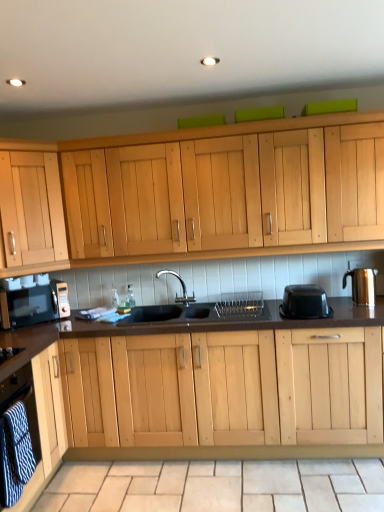
Question: Is black matte sink at center taller or shorter than black plastic container at right?

Choices:
 (A) short
 (B) tall

Answer: (B)

Question: Is point (223, 294) closer or farther from the camera than point (311, 306)?

Choices:
 (A) closer
 (B) farther

Answer: (B)

Question: Which is farther from the matte black microwave at left?

Choices:
 (A) light wood cabinet at upper left, marked as the 1th cabinetry in a back-to-front arrangement
 (B) beige tile at lower center
 (C) black matte sink at center
 (D) black plastic container at right
 (E) light wood cabinet at lower left, placed as the 2th cabinetry when sorted from top to bottom

Answer: (D)

Question: Based on their relative distances, which object is nearer to the black matte sink at center?

Choices:
 (A) beige tile at lower center
 (B) light wood cabinet at lower left, acting as the 2th cabinetry starting from the back
 (C) black plastic container at right
 (D) light wood cabinet at upper left, marked as the 1th cabinetry in a back-to-front arrangement
 (E) gold metallic kettle at right

Answer: (C)